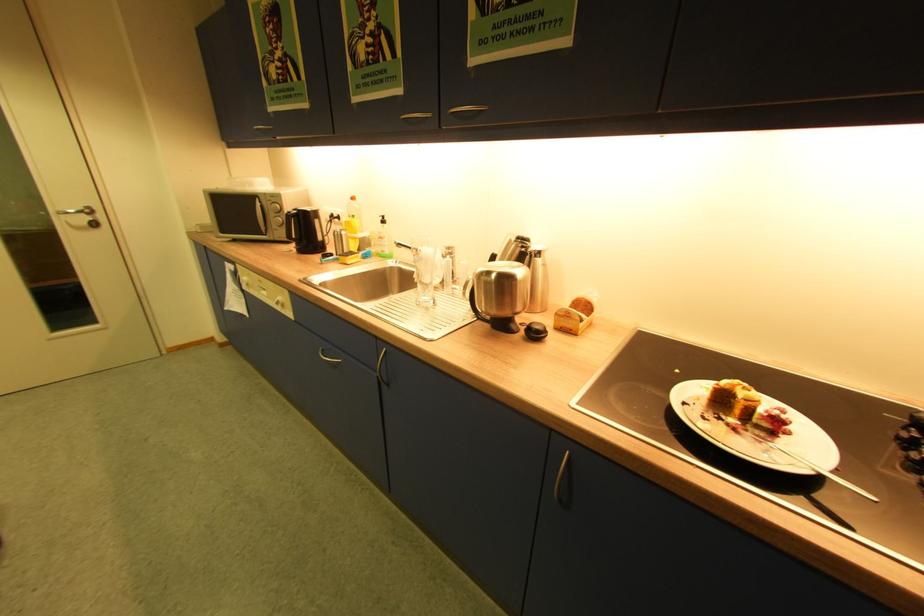
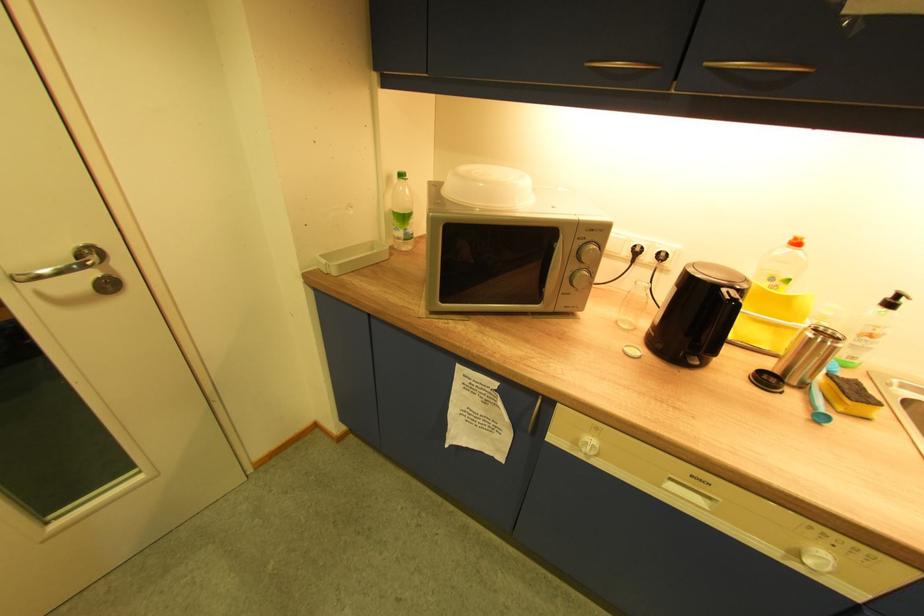
Find the pixel in the second image that matches point 345,264 in the first image.

(843, 413)